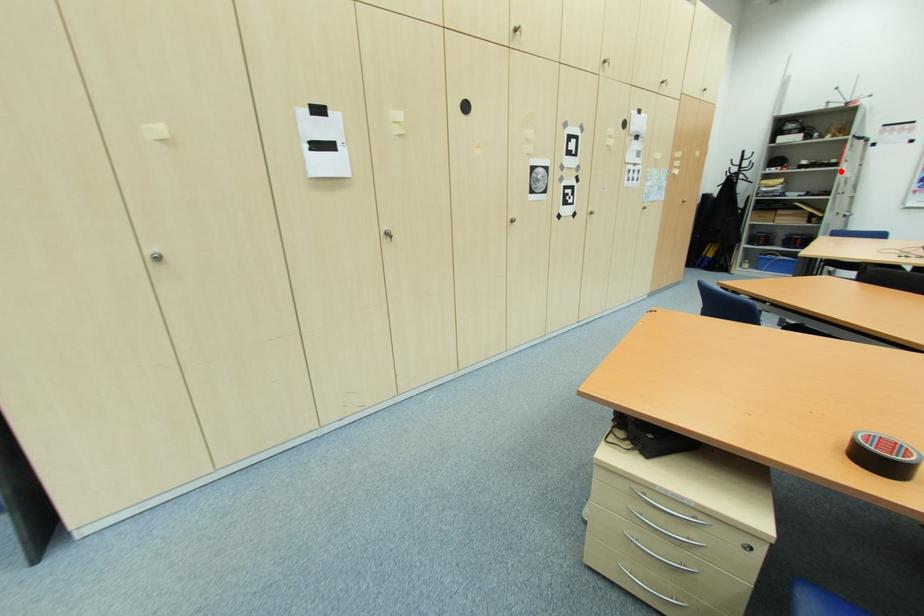
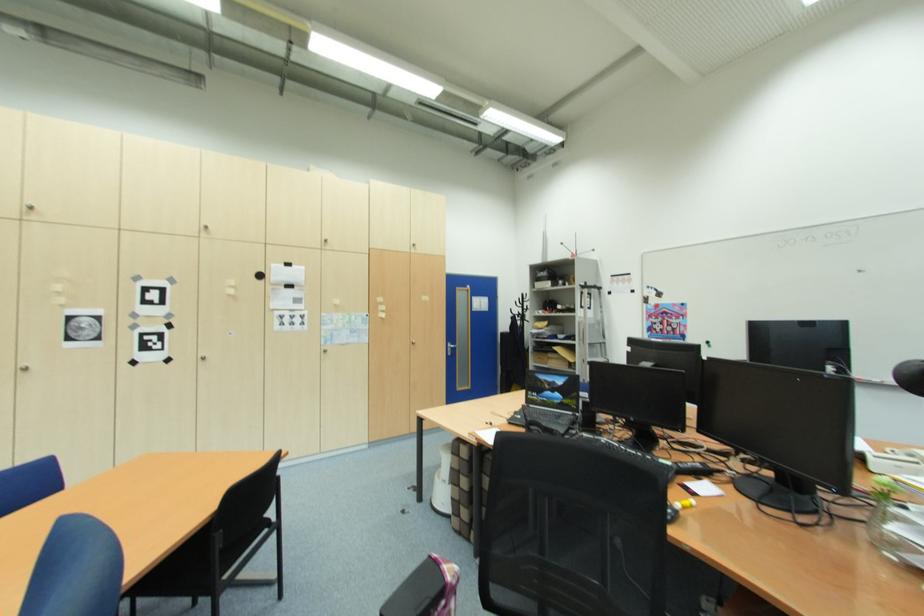
The point at the highlighted location is marked in the first image. Where is the corresponding point in the second image?

(578, 317)